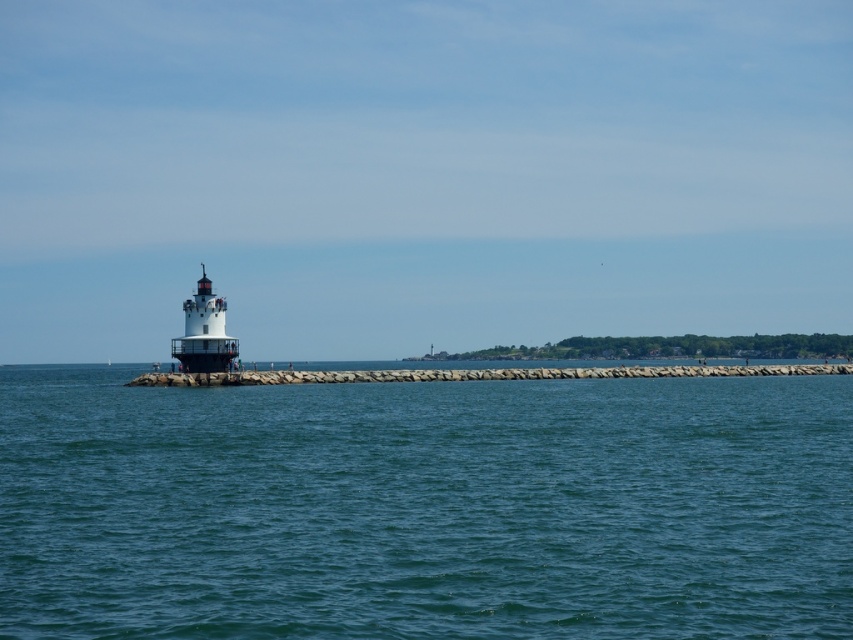
You are standing at point (19, 524) and want to reach the lighthouse. The lighthouse is 89.88 feet away from you. If you can walk 10 feet per minute, how long will it take you to reach the lighthouse?

The distance between you and the lighthouse is 89.88 feet. Since you walk at 10 feet per minute, it will take approximately 8.988 minutes, which rounds to about 9 minutes to reach the lighthouse.

You are a sailor trying to navigate through the coastal area. You see the blue water at center and the smooth concrete wall at center. Which one is lower in height?

The blue water at center is not as tall as the smooth concrete wall at center, so the blue water at center is lower in height.

You are a painter planning to paint the smooth concrete wall at center and the white painted metal lighthouse at left. Which object requires a taller ladder to reach its top?

The smooth concrete wall at center is much taller than the white painted metal lighthouse at left, so you need a taller ladder for the smooth concrete wall at center.